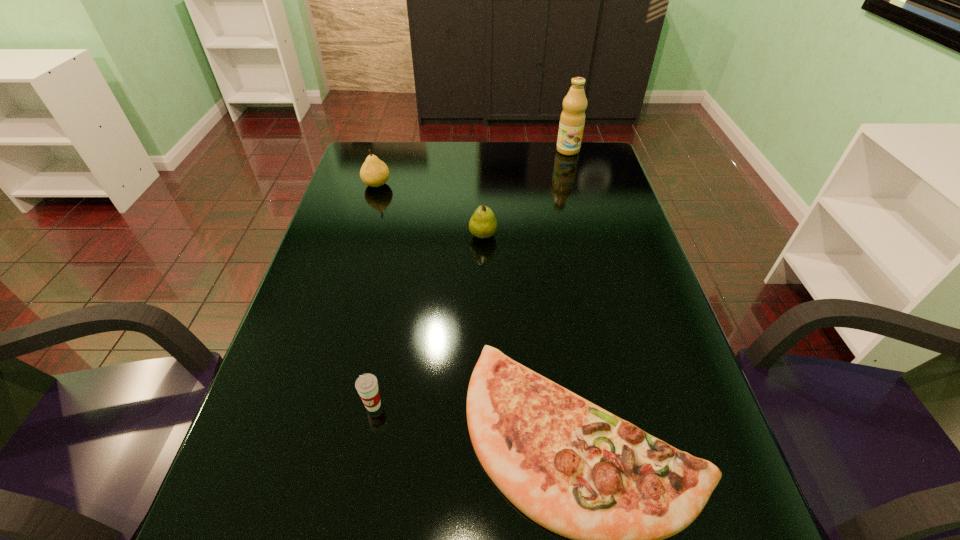
Point out which object is positioned as the nearest to the olive oil. Please provide its 2D coordinates. Your answer should be formatted as a tuple, i.e. [(x, y)], where the tuple contains the x and y coordinates of a point satisfying the conditions above.

[(483, 224)]

Image resolution: width=960 pixels, height=540 pixels. Identify the location of object that stands as the fourth closest to the pizza. (572, 119).

Identify the location of free region that satisfies the following two spatial constraints: 1. on the front side of the nearer pear; 2. on the right side of the leftmost object. Image resolution: width=960 pixels, height=540 pixels. (362, 235).